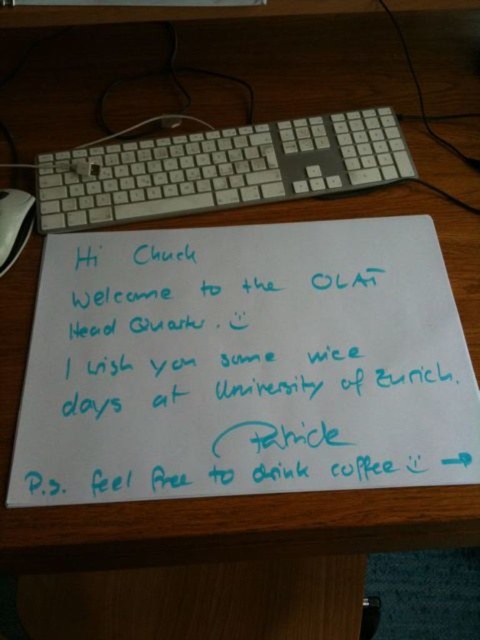
Question: Can you confirm if white paper at center is positioned below black plastic mouse at lower left?

Choices:
 (A) yes
 (B) no

Answer: (A)

Question: Estimate the real-world distances between objects in this image. Which object is closer to the white paper at center?

Choices:
 (A) white plastic keyboard at upper center
 (B) black plastic mouse at lower left

Answer: (A)

Question: Does white plastic keyboard at upper center appear on the left side of black plastic mouse at lower left?

Choices:
 (A) yes
 (B) no

Answer: (B)

Question: Which point is closer to the camera taking this photo?

Choices:
 (A) (396, 148)
 (B) (194, 300)

Answer: (B)

Question: Considering the real-world distances, which object is closest to the white paper at center?

Choices:
 (A) black plastic mouse at lower left
 (B) white plastic keyboard at upper center

Answer: (B)

Question: Is the position of white paper at center less distant than that of black plastic mouse at lower left?

Choices:
 (A) no
 (B) yes

Answer: (B)